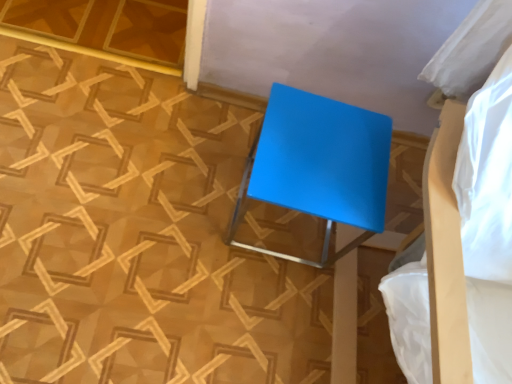
Locate an element on the screen. This screenshot has width=512, height=384. vacant location below blue glossy stool at center (from a real-world perspective) is located at coordinates (285, 228).